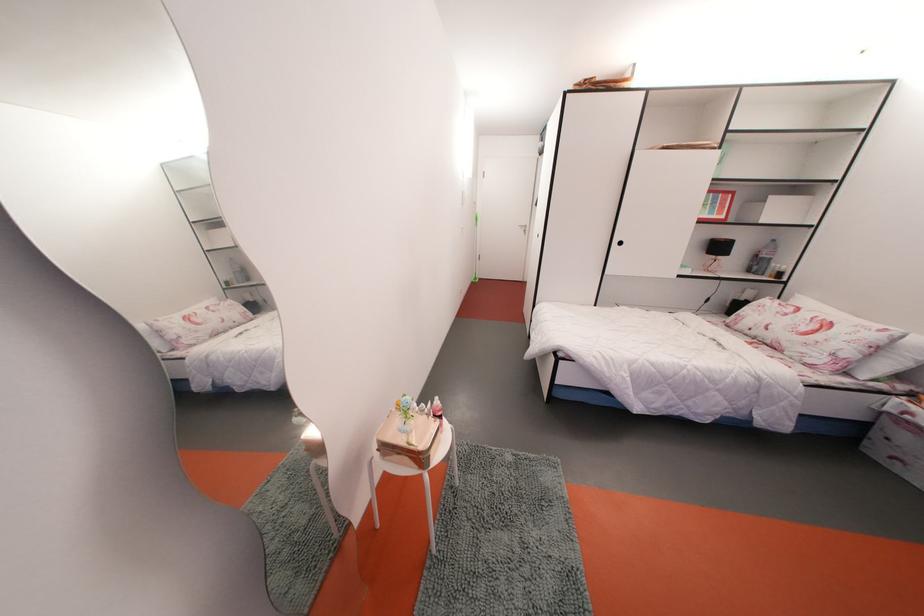
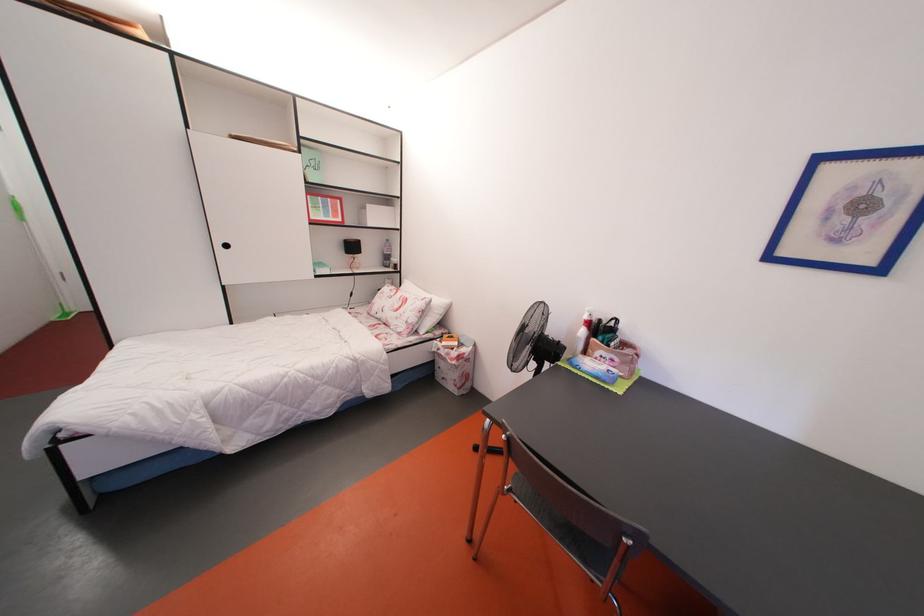
Locate, in the second image, the point that corresponds to (x=840, y=360) in the first image.

(414, 328)